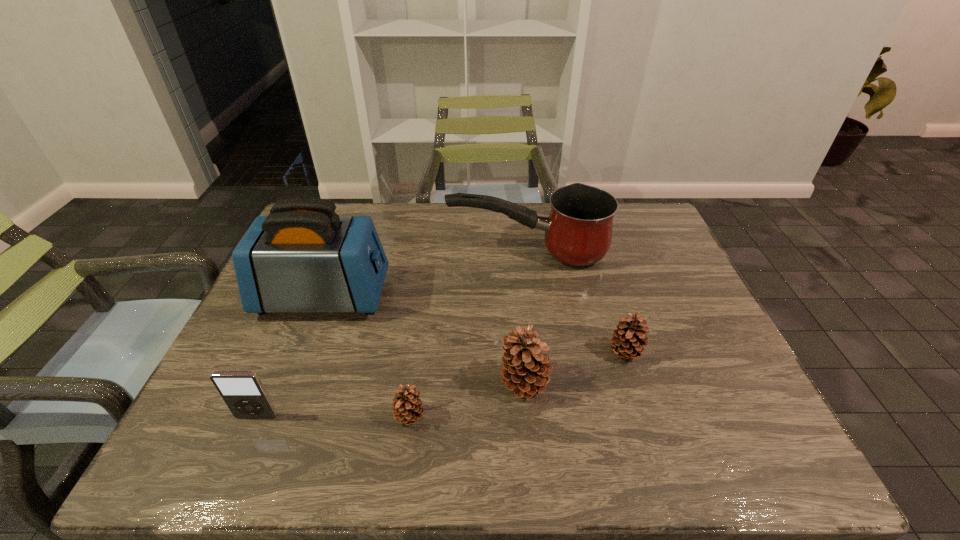
All pinecones are currently evenly spaced. To continue this pattern, where would you add another pinecone on the right? Please point out a vacant spot. Please provide its 2D coordinates. Your answer should be formatted as a tuple, i.e. [(x, y)], where the tuple contains the x and y coordinates of a point satisfying the conditions above.

[(715, 326)]